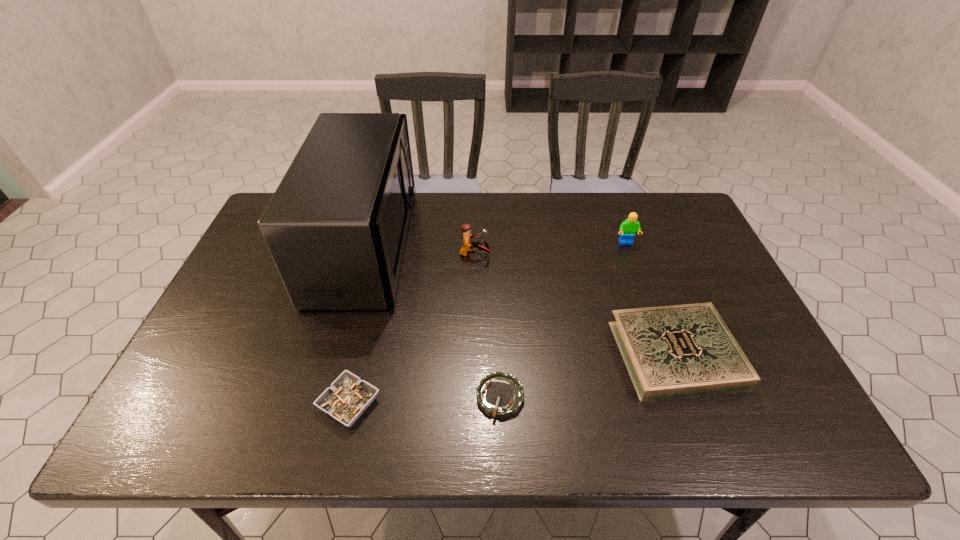
The width and height of the screenshot is (960, 540). Find the location of `free space between the shorter ashtray and the right Lego`. free space between the shorter ashtray and the right Lego is located at coordinates (564, 320).

You are a GUI agent. You are given a task and a screenshot of the screen. Output one action in this format:
    pyautogui.click(x=<x>, y=<y>)
    Task: Click on the object that stands as the fourth closest to the microwave_oven
    
    Given the screenshot: What is the action you would take?
    pyautogui.click(x=678, y=351)

This screenshot has height=540, width=960. I want to click on object that can be found as the third closest to the fifth tallest object, so click(467, 246).

Locate an element on the screen. free space that satisfies the following two spatial constraints: 1. holding a crossbow in the hands of the left Lego; 2. on the front side of the second shortest object is located at coordinates (473, 403).

You are a GUI agent. You are given a task and a screenshot of the screen. Output one action in this format:
    pyautogui.click(x=<x>, y=<y>)
    Task: Click on the free space in the image that satisfies the following two spatial constraints: 1. on the front-facing side of the tallest object; 2. on the left side of the third shortest object
    Image resolution: width=960 pixels, height=540 pixels.
    Given the screenshot: What is the action you would take?
    pyautogui.click(x=335, y=354)

Locate an element on the screen. The image size is (960, 540). free location that satisfies the following two spatial constraints: 1. on the back side of the right ashtray; 2. on the left side of the taller ashtray is located at coordinates (350, 397).

The width and height of the screenshot is (960, 540). I want to click on vacant space that satisfies the following two spatial constraints: 1. on the front-facing side of the microwave_oven; 2. on the left side of the right ashtray, so coord(324,397).

Find the location of `vacant area in the image that satisfies the following two spatial constraints: 1. on the front-facing side of the tallest object; 2. on the left side of the shorter ashtray`. vacant area in the image that satisfies the following two spatial constraints: 1. on the front-facing side of the tallest object; 2. on the left side of the shorter ashtray is located at coordinates (324, 397).

At what (x,y) coordinates should I click in order to perform the action: click on free space that satisfies the following two spatial constraints: 1. holding a crossbow in the hands of the left Lego; 2. on the back side of the shortest object. Please return your answer as a coordinate pair (x, y). Image resolution: width=960 pixels, height=540 pixels. Looking at the image, I should click on (473, 397).

Identify the location of free region that satisfies the following two spatial constraints: 1. on the back side of the left ashtray; 2. on the front-facing side of the tallest object. This screenshot has width=960, height=540. (386, 245).